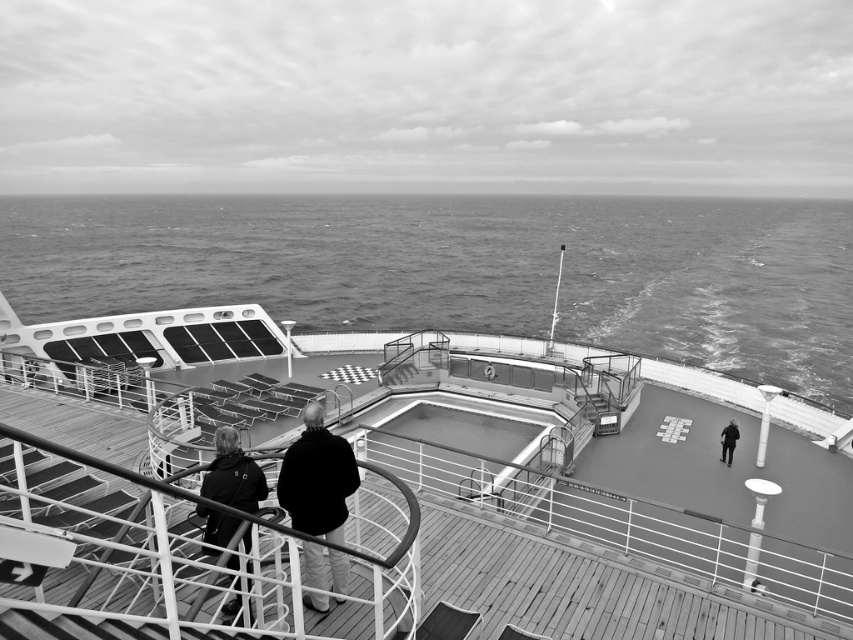
Question: Estimate the real-world distances between objects in this image. Which object is closer to the dark wool coat at center?

Choices:
 (A) dark gray water at center
 (B) dark woolen jacket at center
 (C) dark gray fabric jacket at center right

Answer: (B)

Question: Is the position of dark gray fabric jacket at lower left more distant than that of dark gray fabric jacket at center right?

Choices:
 (A) no
 (B) yes

Answer: (A)

Question: Is wooden deck at center to the left of dark gray water at center from the viewer's perspective?

Choices:
 (A) yes
 (B) no

Answer: (B)

Question: Which point appears closest to the camera in this image?

Choices:
 (A) (343, 486)
 (B) (224, 605)

Answer: (A)

Question: Which object is the closest to the dark gray fabric jacket at center right?

Choices:
 (A) dark gray fabric jacket at lower left
 (B) dark wool coat at center
 (C) dark woolen jacket at center
 (D) dark gray water at center

Answer: (C)

Question: Considering the relative positions of dark gray water at center and dark gray fabric jacket at lower left in the image provided, where is dark gray water at center located with respect to dark gray fabric jacket at lower left?

Choices:
 (A) left
 (B) right

Answer: (B)